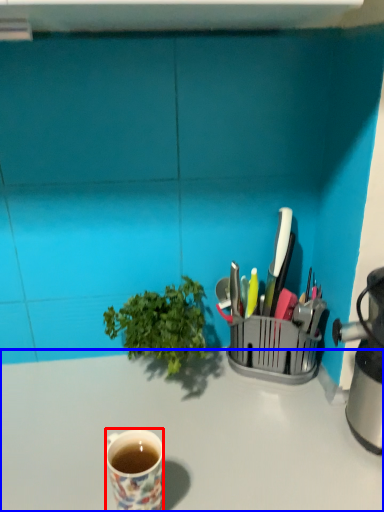
Question: Which point is further to the camera, coffee cup (highlighted by a red box) or desk (highlighted by a blue box)?

Choices:
 (A) coffee cup
 (B) desk

Answer: (B)